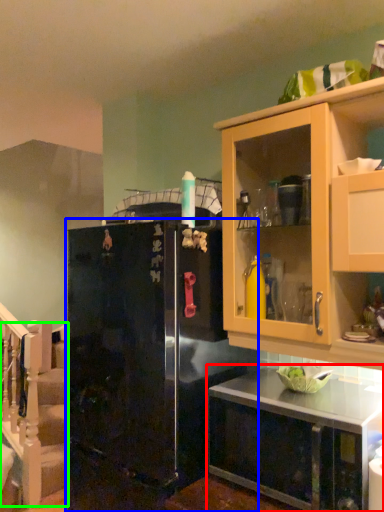
Question: Estimate the real-world distances between objects in this image. Which object is closer to countertop (highlighted by a red box), refrigerator (highlighted by a blue box) or stairwell (highlighted by a green box)?

Choices:
 (A) refrigerator
 (B) stairwell

Answer: (A)